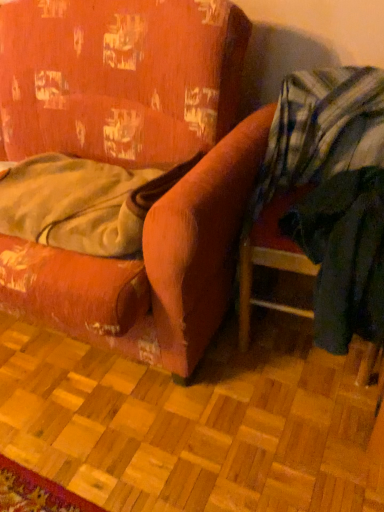
You are a GUI agent. You are given a task and a screenshot of the screen. Output one action in this format:
    pyautogui.click(x=<x>, y=<y>)
    Task: Click on the plaid fabric at right
    The height and width of the screenshot is (512, 384).
    Given the screenshot: What is the action you would take?
    point(333,193)

Describe the element at coordinates (333, 193) in the screenshot. I see `plaid fabric at right` at that location.

What are the coordinates of `plaid fabric at right` in the screenshot? It's located at (333, 193).